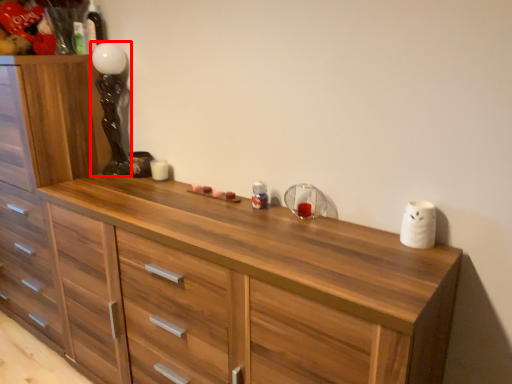
Question: From the image's perspective, what is the correct spatial positioning of lamp (annotated by the red box) in reference to chest of drawers?

Choices:
 (A) below
 (B) above

Answer: (B)